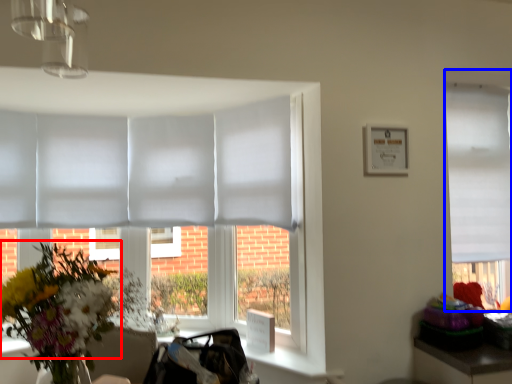
Question: Which object appears closest to the camera in this image, flower (highlighted by a red box) or window (highlighted by a blue box)?

Choices:
 (A) flower
 (B) window

Answer: (A)